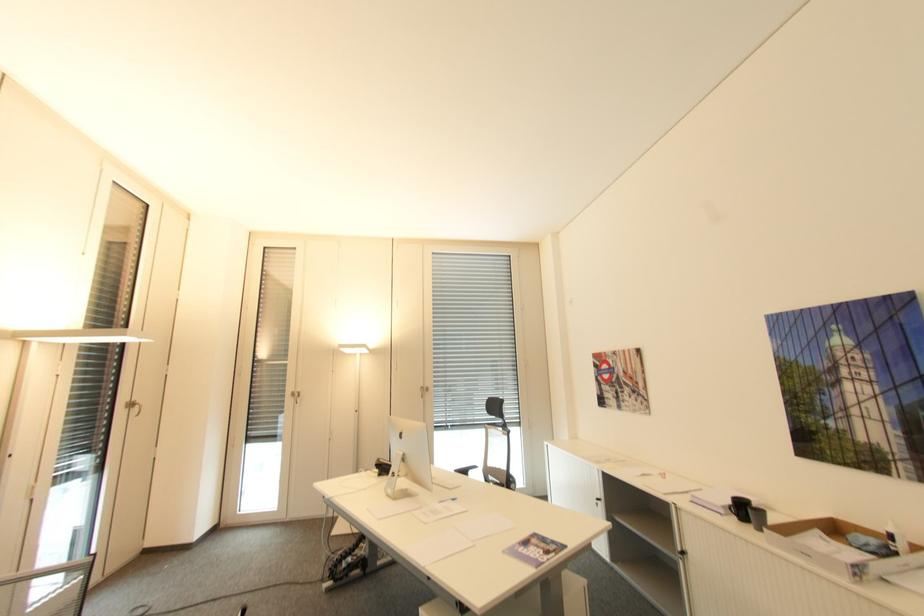
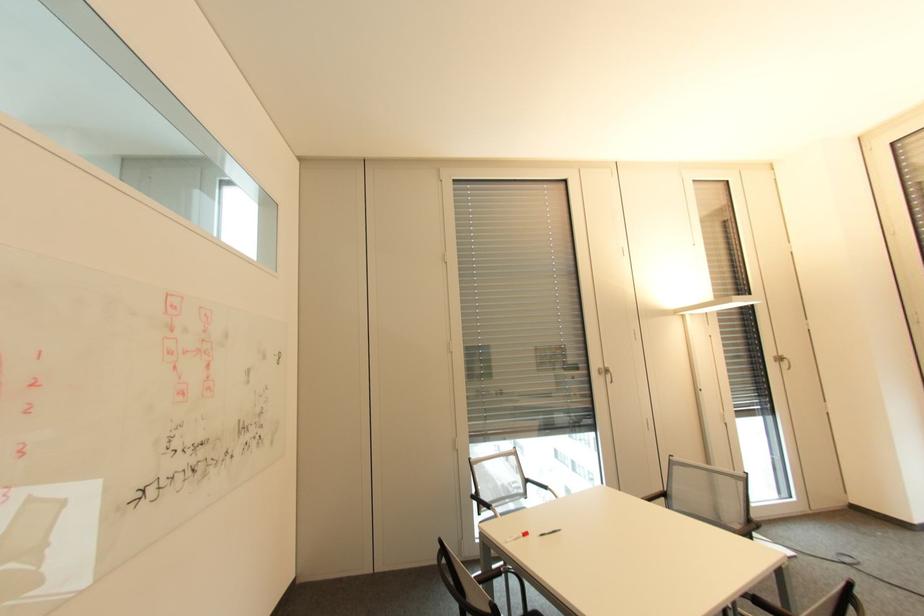
Question: The camera is either moving clockwise (left) or counter-clockwise (right) around the object. The first image is from the beginning of the video and the second image is from the end. Is the camera moving left or right when shooting the video?

Choices:
 (A) Left
 (B) Right

Answer: (B)